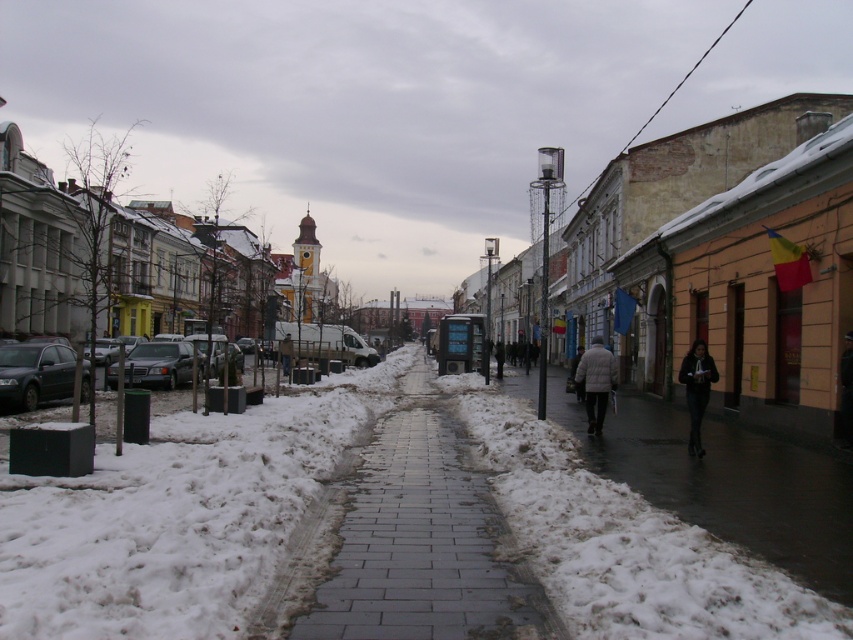
Which is in front, point (27, 404) or point (697, 380)?

Point (697, 380) is more forward.

Measure the distance between matte black car at left and camera.

matte black car at left is 20.51 meters from camera.

At what (x,y) coordinates should I click in order to perform the action: click on matte black car at left. Please return your answer as a coordinate pair (x, y). Looking at the image, I should click on (33, 372).

Which of these two, dark gray concrete sidewalk at lower right or dark gray fabric jacket at lower right, stands taller?

dark gray fabric jacket at lower right is taller.

Does dark gray concrete sidewalk at lower right appear under dark gray fabric jacket at lower right?

Yes, dark gray concrete sidewalk at lower right is below dark gray fabric jacket at lower right.

Find the location of `dark gray concrete sidewalk at lower right`. dark gray concrete sidewalk at lower right is located at coordinates (727, 483).

In the scene shown: Can you confirm if white powdery snow at lower left is taller than gray concrete sidewalk at center?

Correct, white powdery snow at lower left is much taller as gray concrete sidewalk at center.

Is white powdery snow at lower left thinner than gray concrete sidewalk at center?

In fact, white powdery snow at lower left might be wider than gray concrete sidewalk at center.

From the picture: Who is more distant from viewer, [129,506] or [334,620]?

The point [129,506] is behind.

At what (x,y) coordinates should I click in order to perform the action: click on white powdery snow at lower left. Please return your answer as a coordinate pair (x, y). Image resolution: width=853 pixels, height=640 pixels. Looking at the image, I should click on coord(177,516).